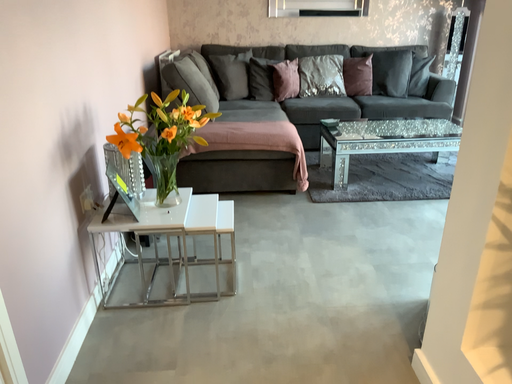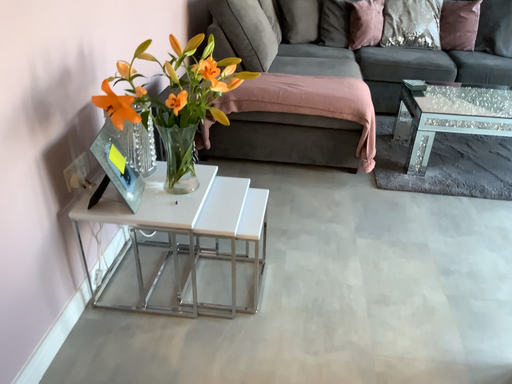
Question: Which way did the camera rotate in the video?

Choices:
 (A) rotated left
 (B) rotated right

Answer: (A)